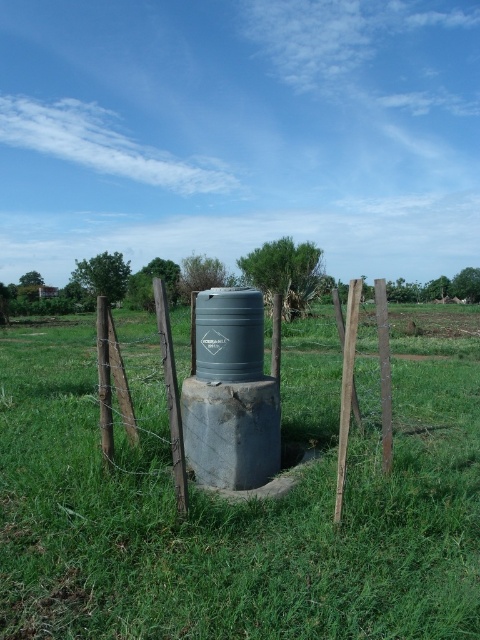
You are standing in the middle of the green grassy at center and looking up. Can you see the wooden post at center from your current position?

Yes, because the green grassy at center is below the wooden post at center, so looking up from the green grassy at center would allow you to see the wooden post at center.

You are standing at the point with coordinates point (342, 467) and want to walk towards the point with coordinates point (322, 557). Which direction should you face to move towards that point?

You should face northeast because point (322, 557) is northeast of point (342, 467).

You are standing at the point marked as point (x=237, y=506) in the image. What is the nearest object to you in the scene?

The nearest object to you at point (x=237, y=506) is the green grassy area at center, as you are standing directly on it.